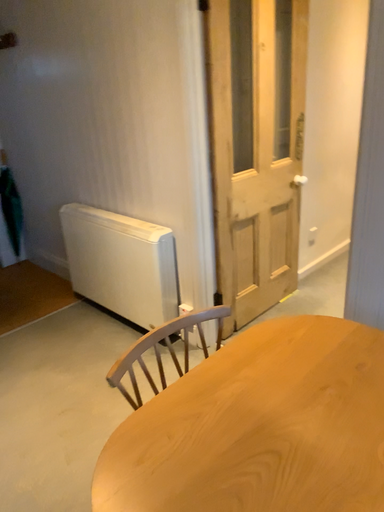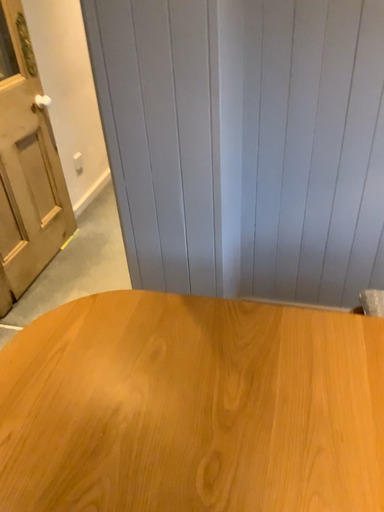
Question: Which way did the camera rotate in the video?

Choices:
 (A) rotated upward
 (B) rotated downward

Answer: (B)